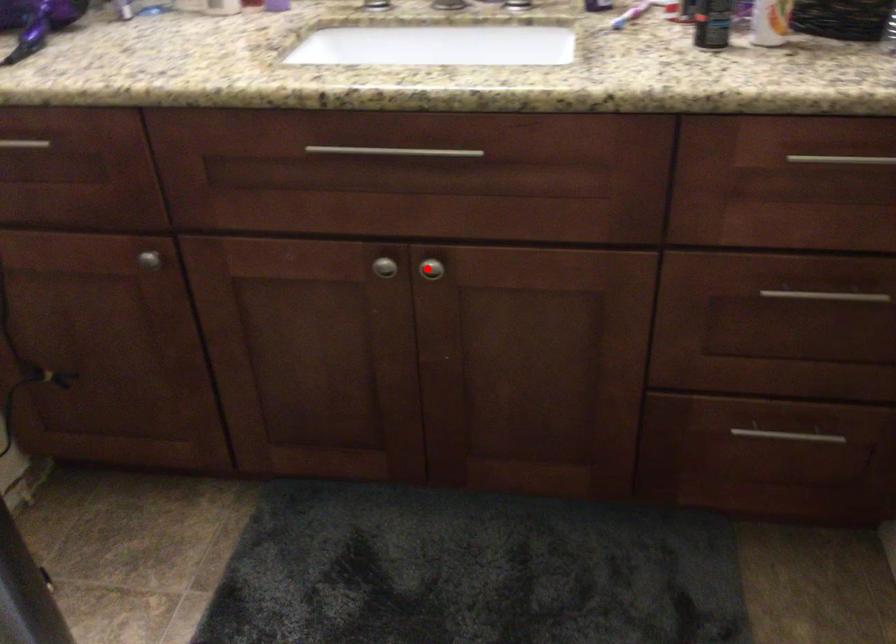
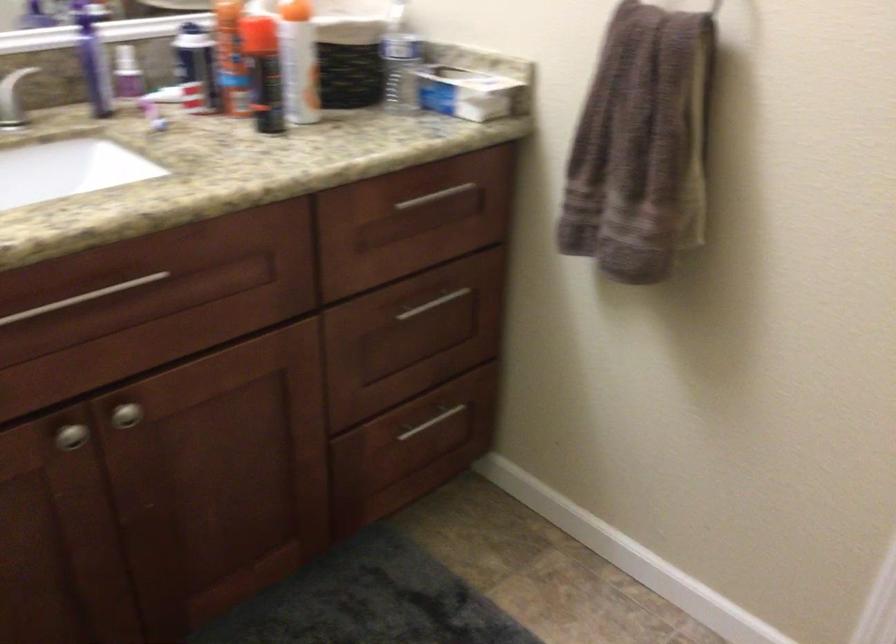
Locate, in the second image, the point that corresponds to the highlighted location in the first image.

(125, 415)